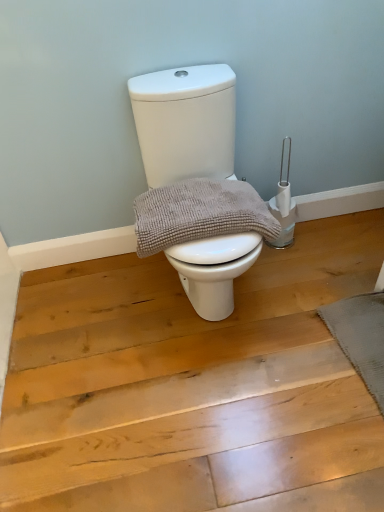
The height and width of the screenshot is (512, 384). Find the location of `gray textured towel at center`. gray textured towel at center is located at coordinates (199, 214).

Measure the distance between point (192, 194) and camera.

Point (192, 194) is 1.46 meters away from camera.

What do you see at coordinates (199, 214) in the screenshot? This screenshot has width=384, height=512. I see `gray textured towel at center` at bounding box center [199, 214].

What is the approximate height of gray textured towel at center?

gray textured towel at center is 4.96 inches in height.

Measure the distance between white matte toilet at center and camera.

They are 1.41 meters apart.

The width and height of the screenshot is (384, 512). What do you see at coordinates (185, 123) in the screenshot? I see `white matte toilet at center` at bounding box center [185, 123].

This screenshot has width=384, height=512. Identify the location of white matte toilet at center. (185, 123).

What is the approximate width of white matte toilet at center?

It is 25.32 inches.

Identify the location of gray textured towel at center. tap(199, 214).

Is white matte toilet at center to the right of gray textured towel at center from the viewer's perspective?

Correct, you'll find white matte toilet at center to the right of gray textured towel at center.

Is the position of white matte toilet at center less distant than that of gray textured towel at center?

Yes, white matte toilet at center is closer to the camera.

Is point (188, 157) less distant than point (205, 227)?

That is False.

From the image's perspective, is white matte toilet at center on top of gray textured towel at center?

Yes, from the image's perspective, white matte toilet at center is above gray textured towel at center.

From a real-world perspective, which object stands above the other?

gray textured towel at center.

Does white matte toilet at center have a lesser width compared to gray textured towel at center?

No.

Based on the photo, considering the sizes of objects white matte toilet at center and gray textured towel at center in the image provided, who is shorter, white matte toilet at center or gray textured towel at center?

With less height is gray textured towel at center.

Considering the sizes of objects white matte toilet at center and gray textured towel at center in the image provided, who is bigger, white matte toilet at center or gray textured towel at center?

white matte toilet at center is bigger.

Is gray textured towel at center inside white matte toilet at center?

Yes, gray textured towel at center is a part of white matte toilet at center.

Is white matte toilet at center far from gray textured towel at center?

Actually, white matte toilet at center and gray textured towel at center are a little close together.

Is white matte toilet at center positioned with its back to gray textured towel at center?

Absolutely, white matte toilet at center is directed away from gray textured towel at center.

How different are the orientations of white matte toilet at center and gray textured towel at center in degrees?

0.000333 degrees.

This screenshot has width=384, height=512. In order to click on toilet that appears above the gray textured towel at center (from the image's perspective) in this screenshot , I will do `click(185, 123)`.

Considering the relative positions of gray textured towel at center and white matte toilet at center in the image provided, is gray textured towel at center to the left of white matte toilet at center from the viewer's perspective?

Correct, you'll find gray textured towel at center to the left of white matte toilet at center.

Which object is further away from the camera taking this photo, gray textured towel at center or white matte toilet at center?

gray textured towel at center is more distant.

Between point (167, 243) and point (214, 142), which one is positioned behind?

Positioned behind is point (214, 142).

From the image's perspective, between gray textured towel at center and white matte toilet at center, who is located below?

gray textured towel at center, from the image's perspective.

From a real-world perspective, is gray textured towel at center on top of white matte toilet at center?

Yes, from a real-world perspective, gray textured towel at center is above white matte toilet at center.

Considering the sizes of gray textured towel at center and white matte toilet at center in the image, is gray textured towel at center wider or thinner than white matte toilet at center?

In the image, gray textured towel at center appears to be more narrow than white matte toilet at center.

Can you confirm if gray textured towel at center is taller than white matte toilet at center?

In fact, gray textured towel at center may be shorter than white matte toilet at center.

Which of these two, gray textured towel at center or white matte toilet at center, is smaller?

With smaller size is gray textured towel at center.

Is white matte toilet at center inside gray textured towel at center?

No, white matte toilet at center is not surrounded by gray textured towel at center.

Is gray textured towel at center beside white matte toilet at center?

They are not placed beside each other.

Is gray textured towel at center facing away from white matte toilet at center?

Yes.

How far apart are gray textured towel at center and white matte toilet at center?

9.76 inches.

The height and width of the screenshot is (512, 384). Identify the location of material lying behind the white matte toilet at center. (199, 214).

Locate an element on the screen. The width and height of the screenshot is (384, 512). material behind the white matte toilet at center is located at coordinates (199, 214).

Find the location of `material located on the left of white matte toilet at center`. material located on the left of white matte toilet at center is located at coordinates (199, 214).